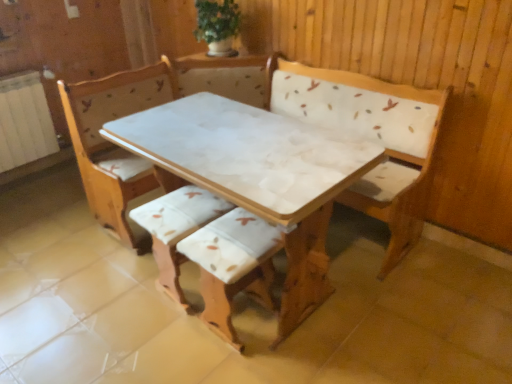
The height and width of the screenshot is (384, 512). I want to click on free space on the front side of wooden armchair at center, which is the first armchair in right-to-left order, so click(240, 367).